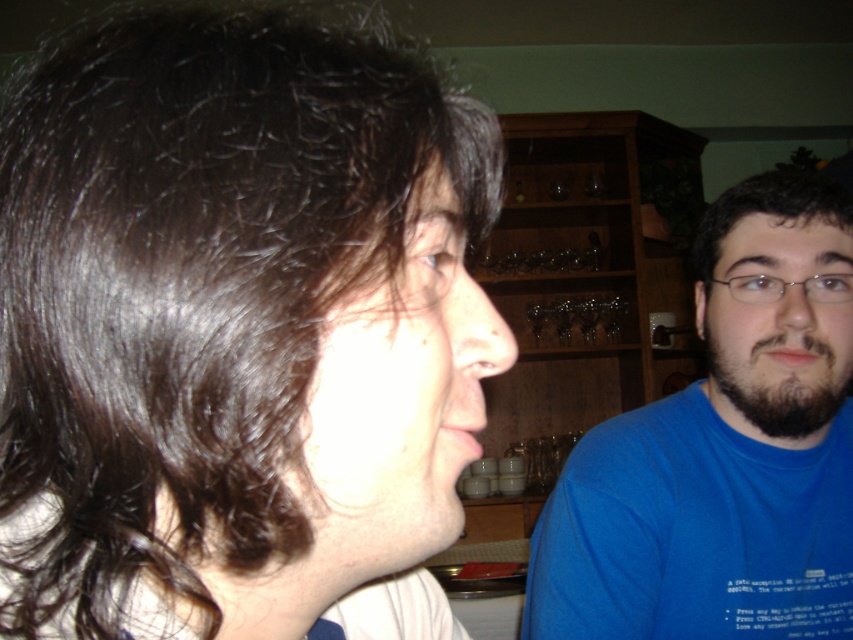
Question: Can you confirm if matte skin face at center is thinner than dark brown beard at right?

Choices:
 (A) yes
 (B) no

Answer: (A)

Question: Which point is farther to the camera?

Choices:
 (A) (424, 209)
 (B) (848, 448)
 (C) (64, 538)

Answer: (B)

Question: In this image, where is blue t-shirt at right located relative to dark brown hair at right?

Choices:
 (A) below
 (B) above

Answer: (A)

Question: Estimate the real-world distances between objects in this image. Which object is farther from the dark brown beard at right?

Choices:
 (A) blue t-shirt at right
 (B) dark brown hair at right

Answer: (B)

Question: Estimate the real-world distances between objects in this image. Which object is closer to the dark brown beard at right?

Choices:
 (A) dark brown hair at right
 (B) blue t-shirt at right
 (C) matte skin face at center
 (D) dark brown hair at upper left

Answer: (B)

Question: Can you confirm if matte skin face at center is thinner than dark brown hair at right?

Choices:
 (A) no
 (B) yes

Answer: (B)